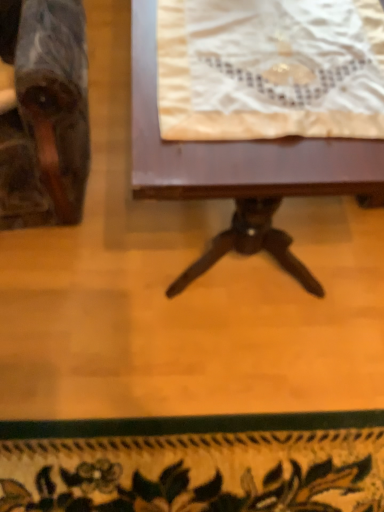
Question: Does white lace cloth at upper center have a larger size compared to wooden table at center?

Choices:
 (A) yes
 (B) no

Answer: (B)

Question: Can you confirm if white lace cloth at upper center is smaller than wooden table at center?

Choices:
 (A) yes
 (B) no

Answer: (A)

Question: Is white lace cloth at upper center thinner than wooden table at center?

Choices:
 (A) yes
 (B) no

Answer: (A)

Question: From a real-world perspective, is white lace cloth at upper center beneath wooden table at center?

Choices:
 (A) yes
 (B) no

Answer: (B)

Question: Is the surface of white lace cloth at upper center in direct contact with wooden table at center?

Choices:
 (A) yes
 (B) no

Answer: (B)

Question: Does point (317, 182) appear closer or farther from the camera than point (324, 4)?

Choices:
 (A) closer
 (B) farther

Answer: (A)

Question: Considering the relative positions of wooden table at center and white lace cloth at upper center in the image provided, is wooden table at center to the left or to the right of white lace cloth at upper center?

Choices:
 (A) left
 (B) right

Answer: (A)

Question: From their relative heights in the image, would you say wooden table at center is taller or shorter than white lace cloth at upper center?

Choices:
 (A) short
 (B) tall

Answer: (B)

Question: Which is correct: wooden table at center is inside white lace cloth at upper center, or outside of it?

Choices:
 (A) outside
 (B) inside

Answer: (A)

Question: Considering the positions of marble-like wooden chair at left and white lace cloth at upper center in the image, is marble-like wooden chair at left taller or shorter than white lace cloth at upper center?

Choices:
 (A) tall
 (B) short

Answer: (A)

Question: From a real-world perspective, is marble-like wooden chair at left positioned above or below white lace cloth at upper center?

Choices:
 (A) above
 (B) below

Answer: (B)

Question: From the image's perspective, is marble-like wooden chair at left positioned above or below white lace cloth at upper center?

Choices:
 (A) below
 (B) above

Answer: (B)

Question: In terms of width, does marble-like wooden chair at left look wider or thinner when compared to white lace cloth at upper center?

Choices:
 (A) wide
 (B) thin

Answer: (A)

Question: Is wooden table at center inside or outside of marble-like wooden chair at left?

Choices:
 (A) inside
 (B) outside

Answer: (B)

Question: Is wooden table at center in front of or behind marble-like wooden chair at left in the image?

Choices:
 (A) behind
 (B) front

Answer: (A)